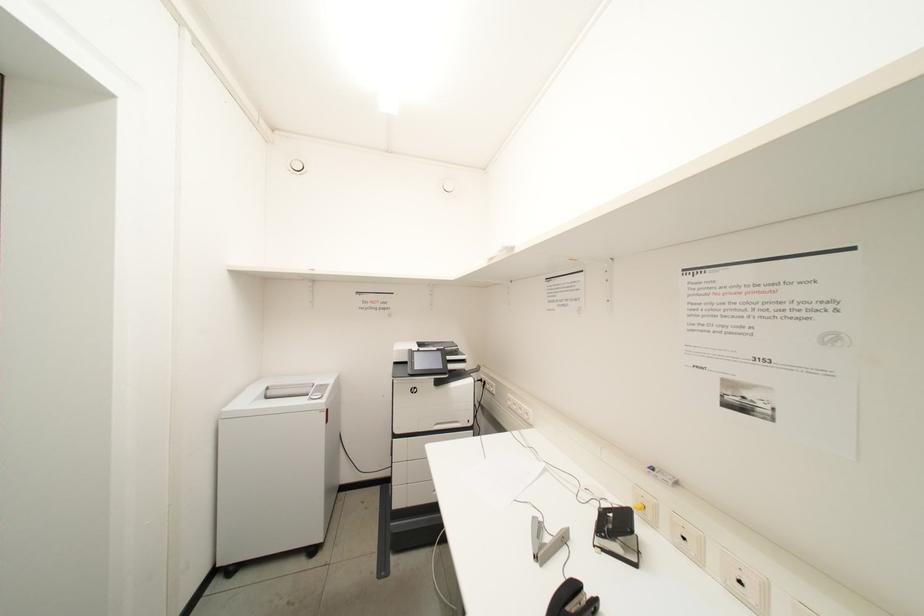
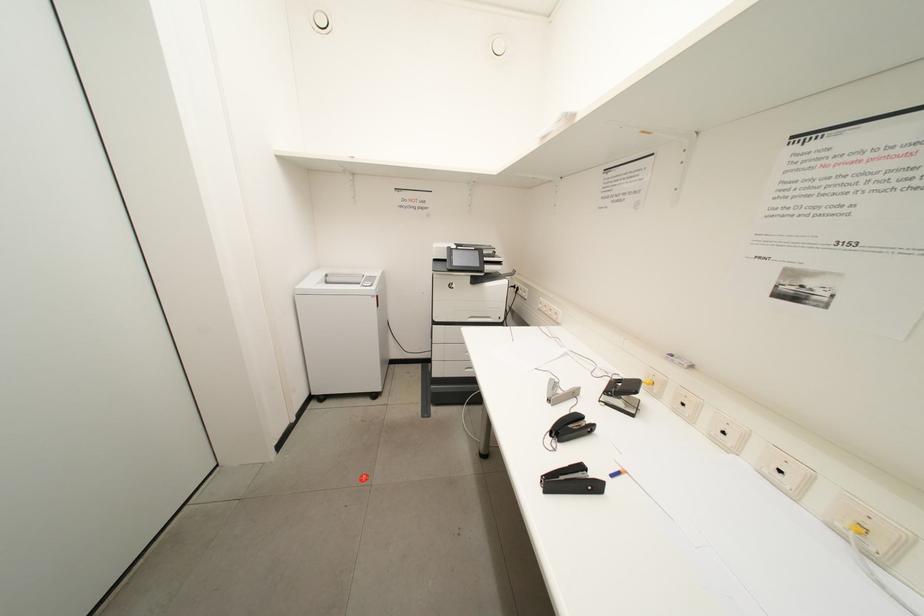
Question: The first image is from the beginning of the video and the second image is from the end. How did the camera likely rotate when shooting the video?

Choices:
 (A) Left
 (B) Right
 (C) Up
 (D) Down

Answer: (D)